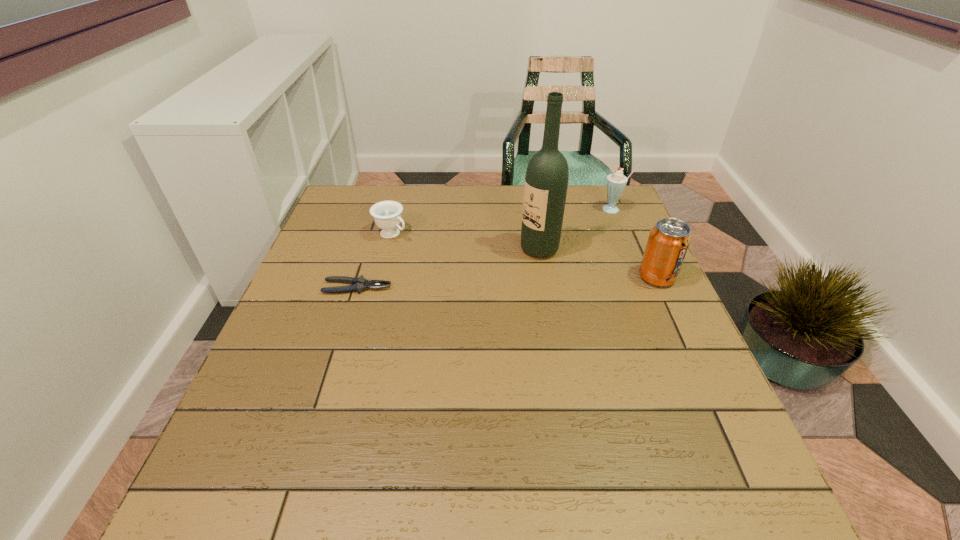
At what (x,y) coordinates should I click in order to perform the action: click on free space between the teacup and the third object from left to right. Please return your answer as a coordinate pair (x, y). The image size is (960, 540). Looking at the image, I should click on (466, 241).

This screenshot has height=540, width=960. I want to click on empty space that is in between the teacup and the third object from right to left, so click(x=466, y=241).

Locate an element on the screen. The width and height of the screenshot is (960, 540). the third closest object to the teacup is located at coordinates (615, 183).

Find the location of a particular element. The height and width of the screenshot is (540, 960). object that stands as the fourth closest to the farthest object is located at coordinates (359, 284).